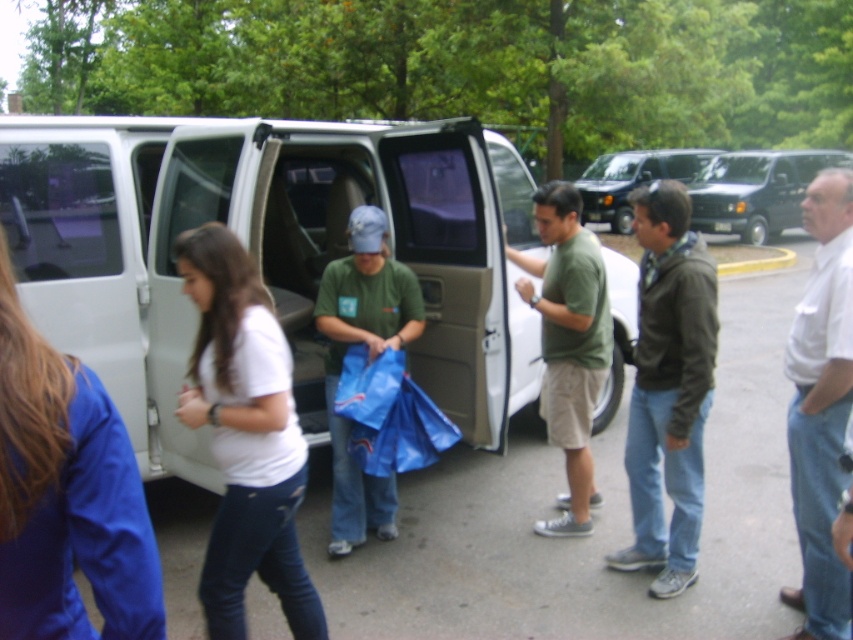
Who is lower down, green matte shirt at center or matte black van at upper right?

green matte shirt at center is below.

Is point (361, 504) farther from viewer compared to point (693, 179)?

That is False.

Does point (357, 330) lie in front of point (746, 218)?

Yes, it is in front of point (746, 218).

Locate an element on the screen. This screenshot has width=853, height=640. green matte shirt at center is located at coordinates (367, 353).

Is point (579, 452) in front of point (674, 156)?

Yes.

Which is above, green matte t-shirt at center or black matte van at center?

black matte van at center is above.

Is point (596, 276) positioned before point (601, 163)?

Yes, it is.

The image size is (853, 640). I want to click on green matte t-shirt at center, so click(567, 342).

Is white matte van at center positioned at the back of green matte shirt at center?

That is True.

Does white matte van at center have a smaller size compared to green matte shirt at center?

Actually, white matte van at center might be larger than green matte shirt at center.

The height and width of the screenshot is (640, 853). I want to click on white matte van at center, so click(267, 252).